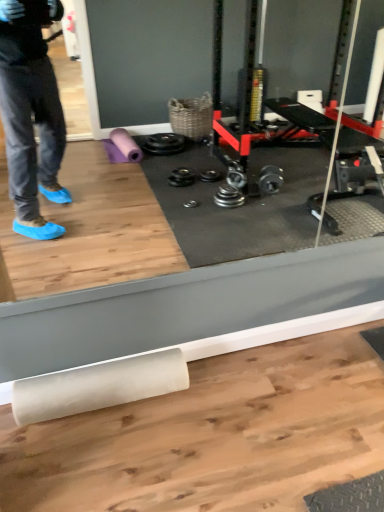
Describe the element at coordinates (98, 386) in the screenshot. I see `white matte paper towel at lower center` at that location.

Image resolution: width=384 pixels, height=512 pixels. What are the coordinates of `white matte paper towel at lower center` in the screenshot? It's located at (98, 386).

Measure the distance between white matte paper towel at lower center and camera.

The distance of white matte paper towel at lower center from camera is 1.46 meters.

Where is `white matte paper towel at lower center`? The width and height of the screenshot is (384, 512). white matte paper towel at lower center is located at coordinates (98, 386).